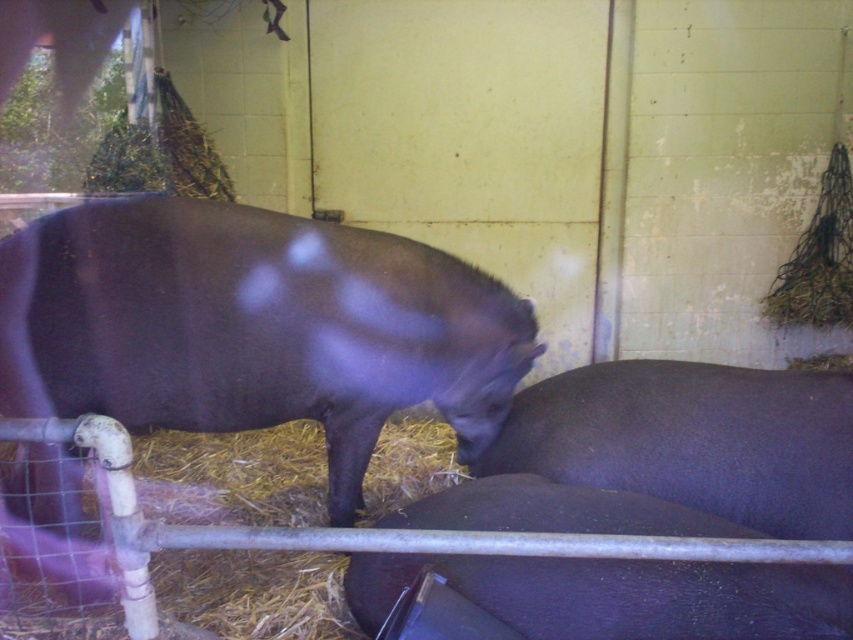
You are a farmer checking the enclosure. You notice two pigs in the enclosure. The shiny dark brown pig at center and the shiny black pig at lower center. Which pig is positioned higher up in the enclosure?

The shiny dark brown pig at center is positioned higher up in the enclosure because it is above the shiny black pig at lower center.